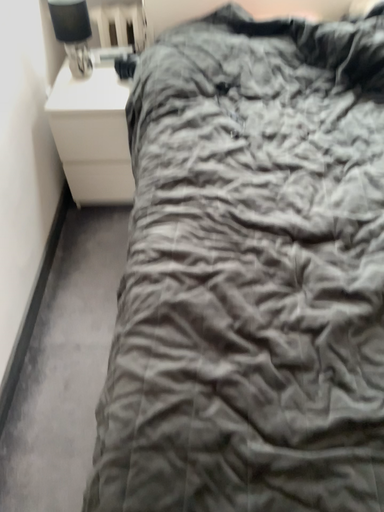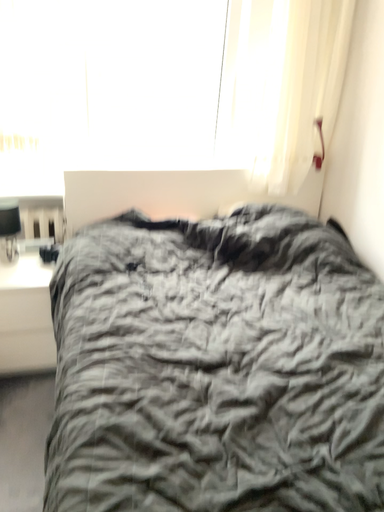
Question: How did the camera likely rotate when shooting the video?

Choices:
 (A) rotated left
 (B) rotated right

Answer: (B)